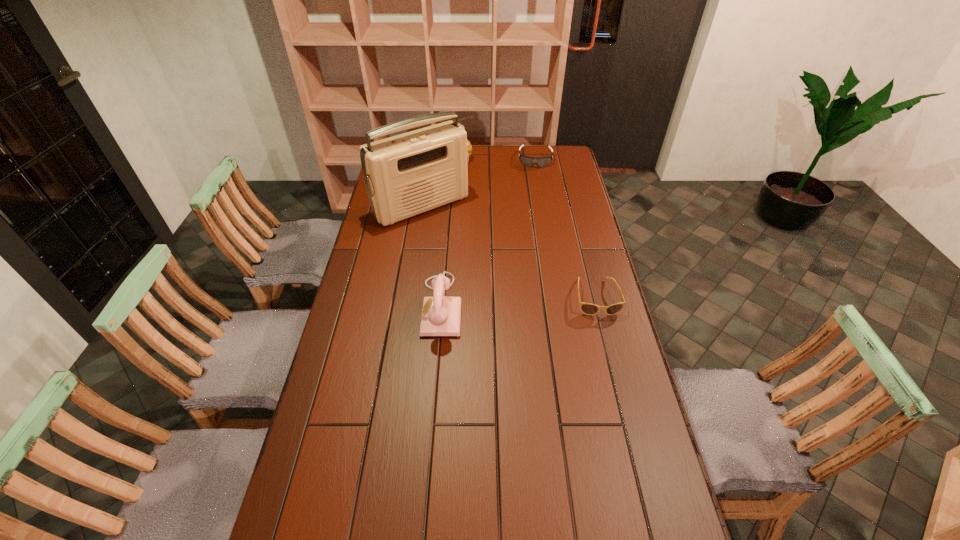
Identify the location of gourd that is at the far edge. (469, 147).

I want to click on object at the left edge, so click(x=405, y=175).

This screenshot has height=540, width=960. What are the coordinates of `sunglasses that is positioned at the right edge` in the screenshot? It's located at (587, 308).

The width and height of the screenshot is (960, 540). In order to click on goggles that is positioned at the right edge in this screenshot , I will do `click(528, 161)`.

Where is `object that is at the far right corner`? object that is at the far right corner is located at coordinates (528, 161).

This screenshot has width=960, height=540. Identify the location of vacant space at the far edge of the desktop. (504, 146).

The height and width of the screenshot is (540, 960). I want to click on vacant area at the left edge of the desktop, so click(x=340, y=336).

I want to click on blank space at the right edge of the desktop, so click(556, 184).

Find the location of a particular element. This screenshot has width=960, height=540. free space between the sunglasses and the third shortest object is located at coordinates (528, 227).

Locate an element on the screen. blank region between the fourth shortest object and the third tallest object is located at coordinates (451, 231).